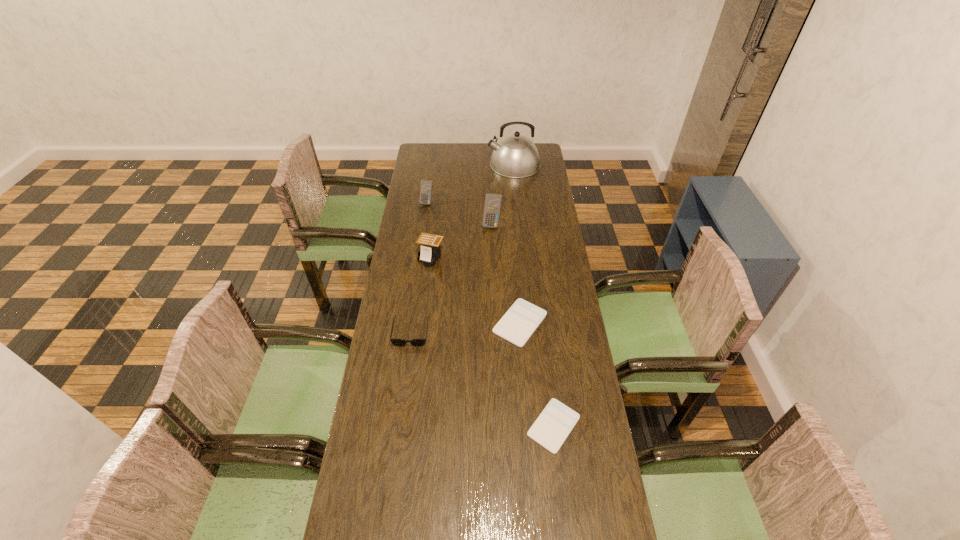
You are a GUI agent. You are given a task and a screenshot of the screen. Output one action in this format:
    pyautogui.click(x=<x>, y=<y>)
    Task: Click on the vacant space situated at the front lenses of the sunglasses
    This screenshot has height=540, width=960.
    Given the screenshot: What is the action you would take?
    pyautogui.click(x=404, y=382)

Image resolution: width=960 pixels, height=540 pixels. What are the coordinates of `vacant area situated on the front of the second shortest calculator` in the screenshot? It's located at (528, 420).

This screenshot has height=540, width=960. I want to click on free point located on the left of the shortest calculator, so (478, 426).

Identify the location of object positioned at the far edge. The height and width of the screenshot is (540, 960). (516, 156).

This screenshot has height=540, width=960. I want to click on sunglasses at the left edge, so 420,342.

Find the location of a particular element. The width and height of the screenshot is (960, 540). kettle present at the right edge is located at coordinates (516, 156).

Find the location of a particular element. The width and height of the screenshot is (960, 540). object located at the far right corner is located at coordinates (x=516, y=156).

Where is `free region at the far edge of the desktop`? This screenshot has width=960, height=540. free region at the far edge of the desktop is located at coordinates (460, 164).

Where is `vacant space at the left edge of the desktop`? This screenshot has height=540, width=960. vacant space at the left edge of the desktop is located at coordinates (400, 322).

The width and height of the screenshot is (960, 540). I want to click on free space at the right edge of the desktop, so click(x=543, y=214).